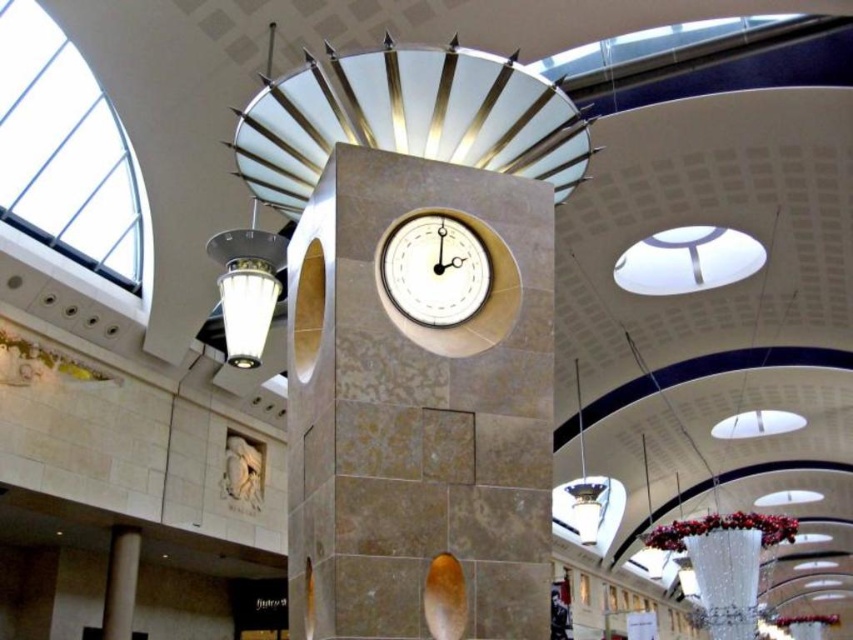
You are a maintenance worker needing to reach the white glossy clock at center for repairs. You have a ladder that can extend up to 2 meters. Given that the smooth beige pillar at lower left is 3 meters tall, can you safely reach the clock with your ladder?

The white glossy clock at center is not as tall as the smooth beige pillar at lower left, which is 3 meters tall. Since the clock is shorter than the pillar, it is likely under 3 meters. Your ladder extends up to 2 meters, so if the clock is within that height, you can reach it. However, without exact measurements, there is some uncertainty.

You are standing in the shopping mall and want to locate the white glossy clock at center. According to the coordinates provided, where exactly is it positioned?

The white glossy clock at center is positioned at coordinates point [434,269].

What object is located at the coordinates point (419, 403) in the image?

The matte stone clock at center is located at point (419, 403).